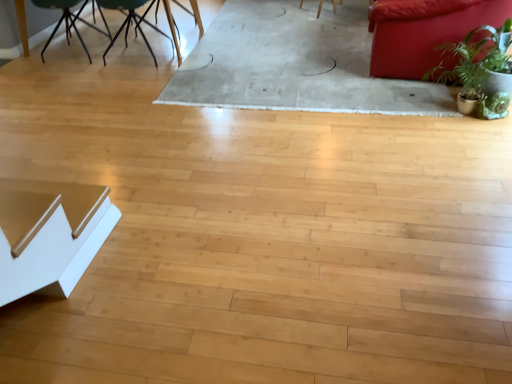
Find the location of a particular element. Image resolution: width=512 pixels, height=384 pixels. free space between green leafy plant at right and white glossy table at lower left is located at coordinates (285, 182).